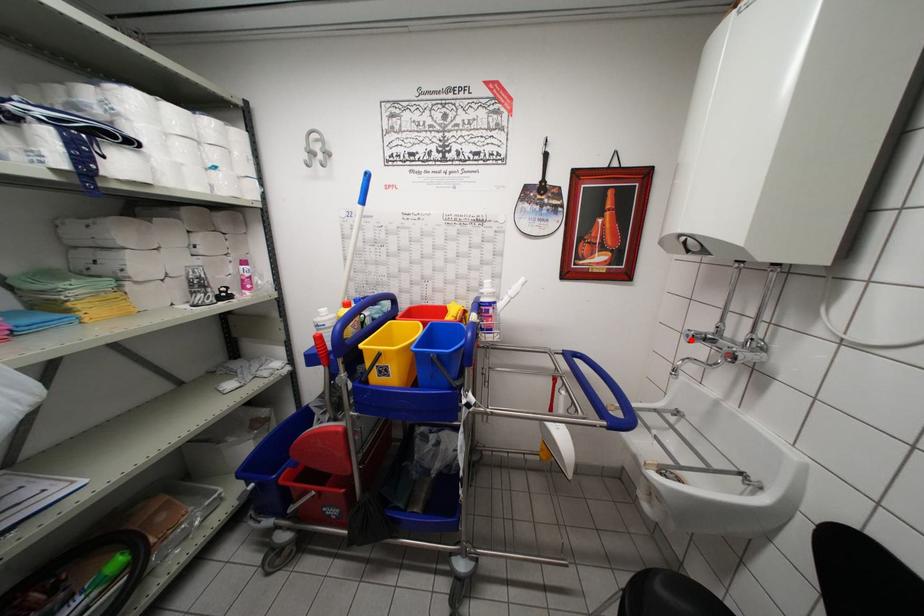
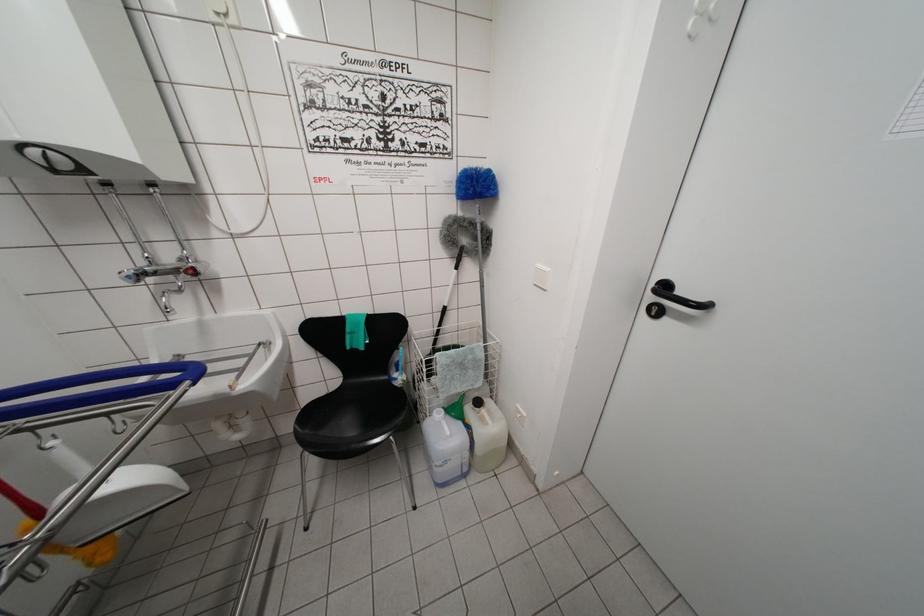
Locate, in the second image, the point that corresponds to the highlighted location in the first image.

(131, 282)